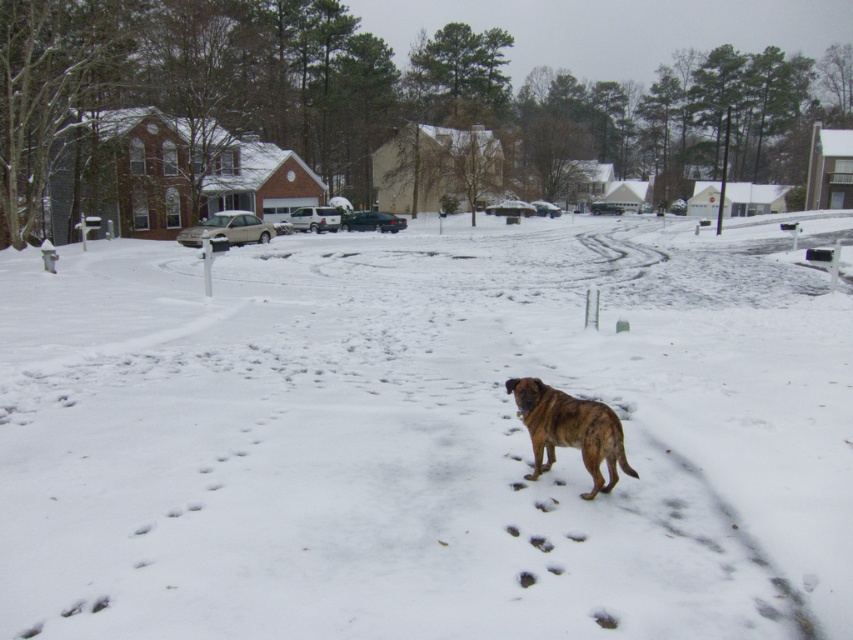
Based on the photo, you are a delivery robot that needs to deliver a package to the house in the background. You are currently standing on the white fluffy snow at center. There is a brindle fur dog at center nearby. Can you safely move forward to avoid the dog?

The white fluffy snow at center might be wider than brindle fur dog at center, so there might be enough space to move around the dog safely.